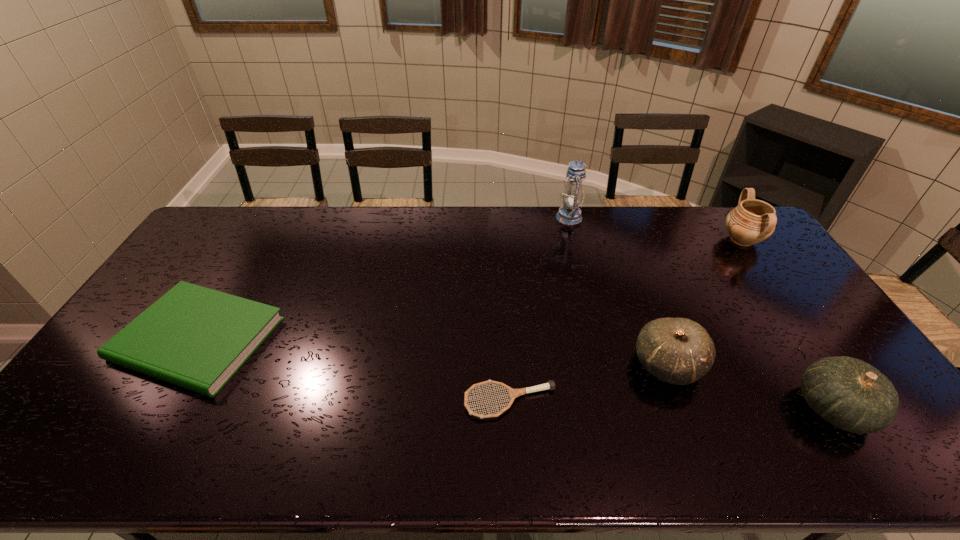
Locate an element on the screen. free point located on the front-facing side of the lantern is located at coordinates (457, 217).

The image size is (960, 540). I want to click on vacant region located 0.060m on the front-facing side of the lantern, so click(x=540, y=217).

The width and height of the screenshot is (960, 540). I want to click on blank space located 0.180m on the front-facing side of the urn, so click(671, 240).

The height and width of the screenshot is (540, 960). Find the location of `free region located 0.230m on the front-facing side of the urn`. free region located 0.230m on the front-facing side of the urn is located at coordinates (657, 240).

What are the coordinates of `free space located on the front-facing side of the urn` in the screenshot? It's located at (674, 240).

The width and height of the screenshot is (960, 540). In order to click on vacant space situated on the back of the right gourd in this screenshot , I will do `click(775, 317)`.

This screenshot has width=960, height=540. I want to click on vacant space located 0.150m on the left of the left gourd, so click(577, 364).

Where is `vacant space situated on the back of the paperback book`? vacant space situated on the back of the paperback book is located at coordinates (238, 271).

Where is `free space located on the right of the shortest object`? free space located on the right of the shortest object is located at coordinates (596, 402).

What are the coordinates of `lantern that is at the far edge` in the screenshot? It's located at (570, 214).